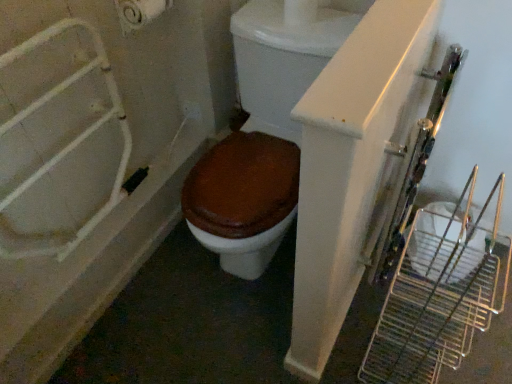
Question: From the image's perspective, is brown matte toilet at center located beneath white glossy bathtub at left?

Choices:
 (A) no
 (B) yes

Answer: (A)

Question: Is brown matte toilet at center smaller than white glossy bathtub at left?

Choices:
 (A) no
 (B) yes

Answer: (A)

Question: Does brown matte toilet at center come behind white glossy bathtub at left?

Choices:
 (A) yes
 (B) no

Answer: (B)

Question: Considering the relative sizes of brown matte toilet at center and white glossy bathtub at left in the image provided, is brown matte toilet at center wider than white glossy bathtub at left?

Choices:
 (A) no
 (B) yes

Answer: (A)

Question: Is brown matte toilet at center far from white glossy bathtub at left?

Choices:
 (A) no
 (B) yes

Answer: (A)

Question: Does brown matte toilet at center have a lesser width compared to white glossy bathtub at left?

Choices:
 (A) yes
 (B) no

Answer: (A)

Question: Is white glossy bathtub at left oriented towards white matte toilet paper at upper left?

Choices:
 (A) no
 (B) yes

Answer: (A)

Question: Are white glossy bathtub at left and white matte toilet paper at upper left located far from each other?

Choices:
 (A) yes
 (B) no

Answer: (B)

Question: From the image's perspective, is white glossy bathtub at left above white matte toilet paper at upper left?

Choices:
 (A) yes
 (B) no

Answer: (B)

Question: Considering the relative sizes of white glossy bathtub at left and white matte toilet paper at upper left in the image provided, is white glossy bathtub at left taller than white matte toilet paper at upper left?

Choices:
 (A) yes
 (B) no

Answer: (A)

Question: Is white glossy bathtub at left further to the viewer compared to white matte toilet paper at upper left?

Choices:
 (A) yes
 (B) no

Answer: (B)

Question: Considering the relative sizes of white glossy bathtub at left and white matte toilet paper at upper left in the image provided, is white glossy bathtub at left bigger than white matte toilet paper at upper left?

Choices:
 (A) yes
 (B) no

Answer: (A)

Question: Is brown matte toilet at center in contact with white matte toilet paper at upper left?

Choices:
 (A) no
 (B) yes

Answer: (A)